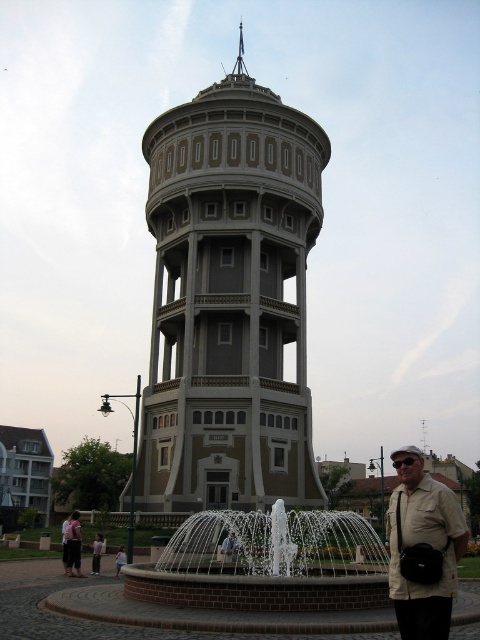
The width and height of the screenshot is (480, 640). Find the location of `pink fabric dress at lower left`. pink fabric dress at lower left is located at coordinates (x=73, y=545).

Who is taller, pink fabric dress at lower left or light blue denim jeans at lower center?

pink fabric dress at lower left

Is point (75, 566) less distant than point (116, 573)?

Yes, it is.

Identify the location of pink fabric dress at lower left. (73, 545).

Who is lower down, gray concrete tower at center or white ceramic fountain at center?

white ceramic fountain at center

Does point (192, 323) come behind point (231, 515)?

Yes, point (192, 323) is behind point (231, 515).

Is point (277, 330) behind point (298, 566)?

Yes, point (277, 330) is behind point (298, 566).

Image resolution: width=480 pixels, height=640 pixels. I want to click on gray concrete tower at center, so click(228, 301).

Can you confirm if tan fabric shirt at center is positioned to the right of light pink fabric dress at lower left?

Indeed, tan fabric shirt at center is positioned on the right side of light pink fabric dress at lower left.

Does tan fabric shirt at center appear over light pink fabric dress at lower left?

Indeed, tan fabric shirt at center is positioned over light pink fabric dress at lower left.

In the scene shown: Who is more forward, (227,556) or (97,561)?

Point (227,556) is in front.

Locate an element on the screen. The image size is (480, 640). tan fabric shirt at center is located at coordinates (229, 547).